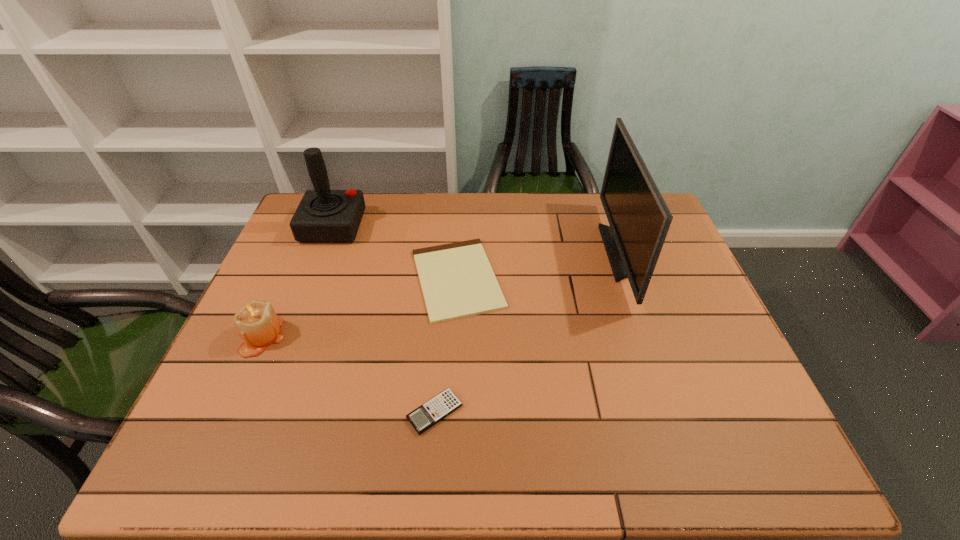
The width and height of the screenshot is (960, 540). What are the coordinates of `monitor` in the screenshot? It's located at (639, 218).

Where is `joystick`? joystick is located at coordinates 323,216.

The height and width of the screenshot is (540, 960). Identify the location of the third tallest object. (257, 323).

Identify the location of the second shortest object. This screenshot has width=960, height=540. (439, 407).

Identify the location of calculator. (439, 407).

Identify the location of the shortest object. (457, 280).

The width and height of the screenshot is (960, 540). In order to click on free space located on the screen side of the monitor in this screenshot , I will do `click(512, 253)`.

Image resolution: width=960 pixels, height=540 pixels. Find the location of `free location located on the screen side of the monitor`. free location located on the screen side of the monitor is located at coordinates (501, 253).

Find the location of `free space located on the screen side of the monitor`. free space located on the screen side of the monitor is located at coordinates (528, 253).

The image size is (960, 540). In order to click on vacant space located on the base of the fourth shortest object in this screenshot , I will do `click(442, 226)`.